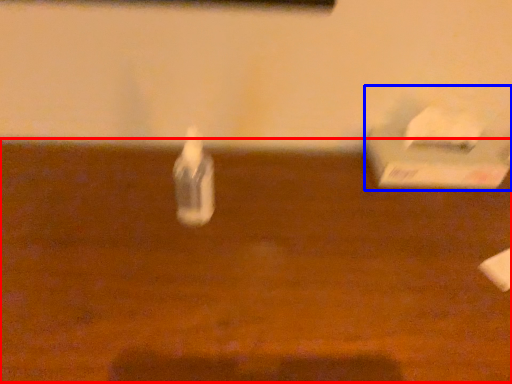
Question: Which object appears closest to the camera in this image, table (highlighted by a red box) or box (highlighted by a blue box)?

Choices:
 (A) table
 (B) box

Answer: (A)